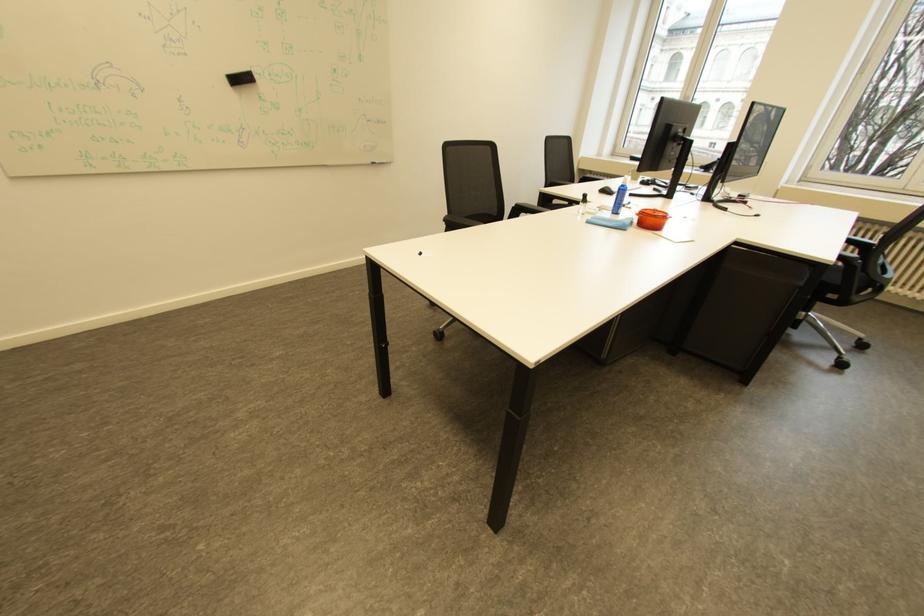
Find where to wip the blue cleaning cloth. Please return your answer as a coordinate pair (x, y).

(611, 222)